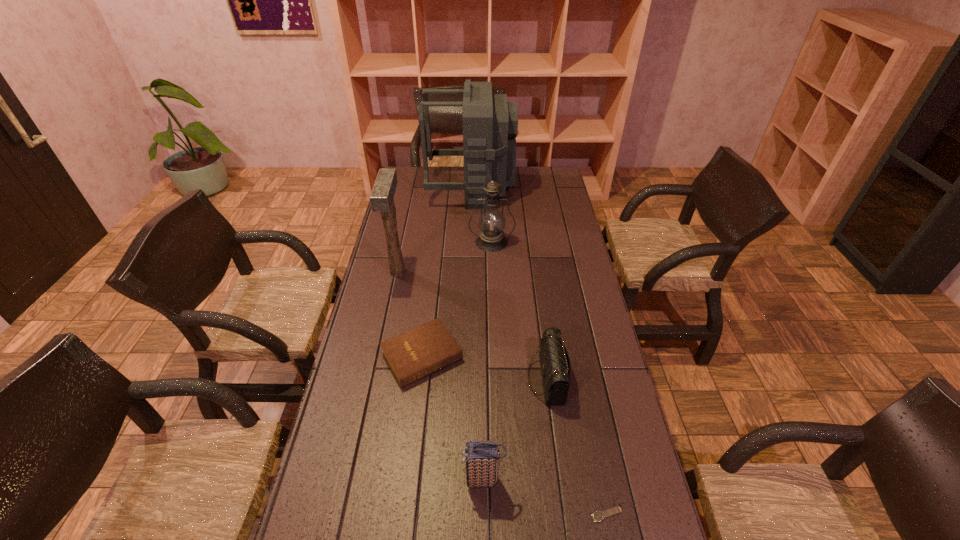
Find the location of `free space located on the front flap of the shorter clutch bag`. free space located on the front flap of the shorter clutch bag is located at coordinates (484, 378).

At what (x,y) coordinates should I click in order to perform the action: click on vacant space situated 0.140m on the front flap of the shorter clutch bag. Please return your answer as a coordinate pair (x, y). This screenshot has width=960, height=540. Looking at the image, I should click on (481, 378).

You are a GUI agent. You are given a task and a screenshot of the screen. Output one action in this format:
    pyautogui.click(x=<x>, y=<y>)
    Task: Click on the free space located 0.130m on the front of the sixth tallest object
    
    Given the screenshot: What is the action you would take?
    pos(413,431)

Identify the location of free location located on the back of the rightmost object. (588, 421).

Identify the location of object that is at the far edge. This screenshot has height=540, width=960. (490, 124).

Identify the location of backpack situated at the left edge. (490, 124).

The height and width of the screenshot is (540, 960). Find the location of `mallet at the left edge`. mallet at the left edge is located at coordinates (381, 198).

You are a GUI agent. You are given a task and a screenshot of the screen. Output one action in this format:
    pyautogui.click(x=<x>, y=<y>)
    Task: Click on the Bible located in the left edge section of the desktop
    This screenshot has height=540, width=960.
    Given the screenshot: What is the action you would take?
    pyautogui.click(x=415, y=354)

Image resolution: width=960 pixels, height=540 pixels. What are the coordinates of `clutch bag positioned at the right edge` in the screenshot? It's located at (554, 360).

Find the location of a particular element. watch at the right edge is located at coordinates (596, 516).